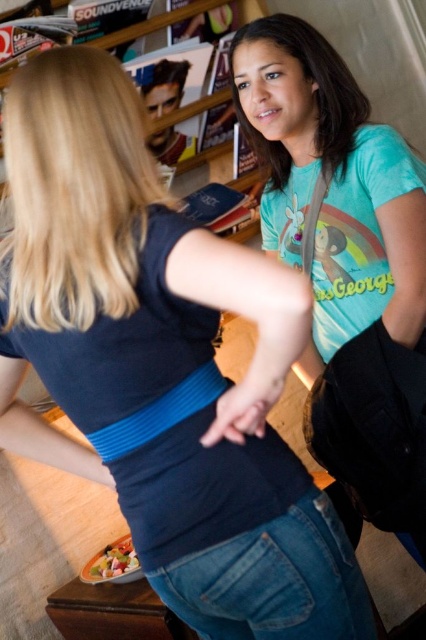
Question: Where is wooden bookshelf at upper center located in relation to smooth plastic container at lower left in the image?

Choices:
 (A) left
 (B) right

Answer: (B)

Question: Which object is positioned closest to the smooth plastic container at lower left?

Choices:
 (A) teal matte t-shirt at center
 (B) wooden bookshelf at upper center

Answer: (A)

Question: Is teal matte t-shirt at center wider than wooden bookshelf at upper center?

Choices:
 (A) yes
 (B) no

Answer: (B)

Question: Which point is closer to the camera taking this photo?

Choices:
 (A) (348, 221)
 (B) (154, 128)

Answer: (A)

Question: Does teal matte t-shirt at center appear over smooth plastic container at lower left?

Choices:
 (A) yes
 (B) no

Answer: (A)

Question: Which point is farther to the camera?

Choices:
 (A) smooth plastic container at lower left
 (B) wooden bookshelf at upper center
 (C) teal matte t-shirt at center

Answer: (B)